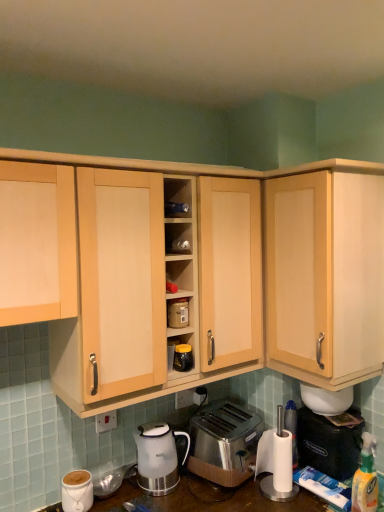
You are a GUI agent. You are given a task and a screenshot of the screen. Output one action in this format:
    pyautogui.click(x=<x>, y=<y>)
    Task: Click on the vacant point above black plastic coffee machine at lower right (from a real-world perspective)
    This screenshot has width=384, height=512.
    Given the screenshot: What is the action you would take?
    pyautogui.click(x=338, y=415)